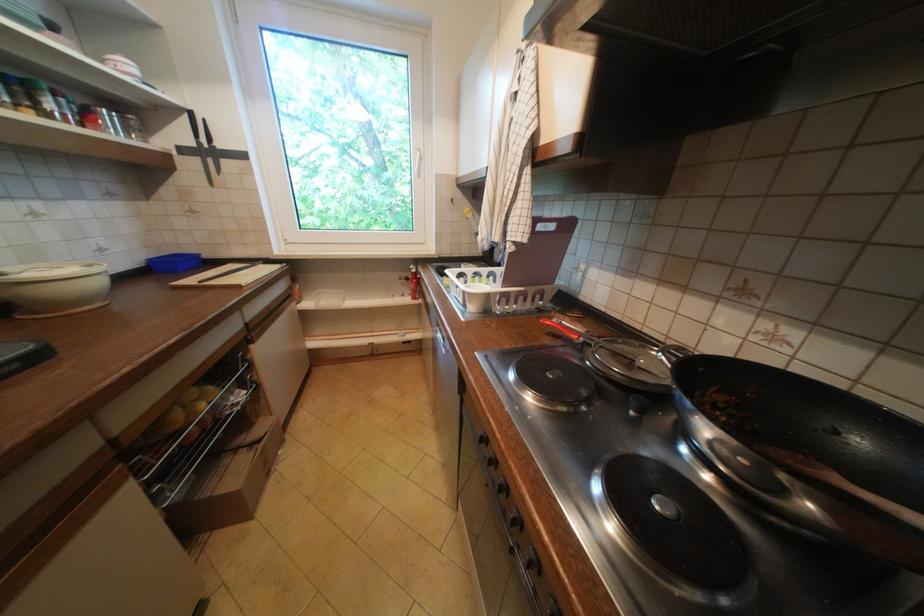
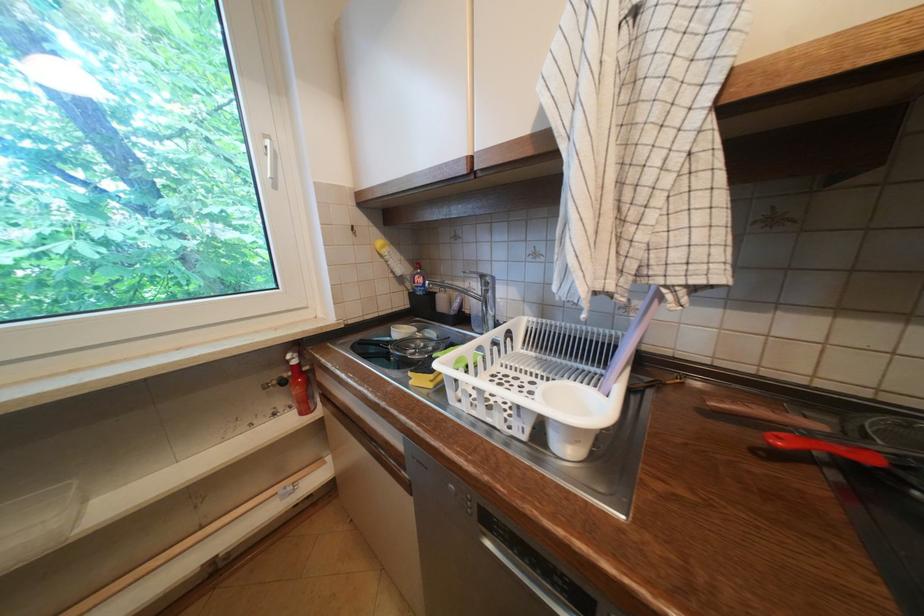
Locate, in the second image, the point that corresponds to (478,302) in the first image.

(586, 443)